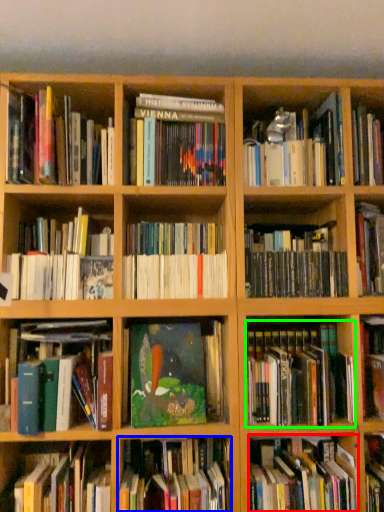
Question: Estimate the real-world distances between objects in this image. Which object is farther from book (highlighted by a red box), book (highlighted by a blue box) or book (highlighted by a green box)?

Choices:
 (A) book
 (B) book

Answer: (A)